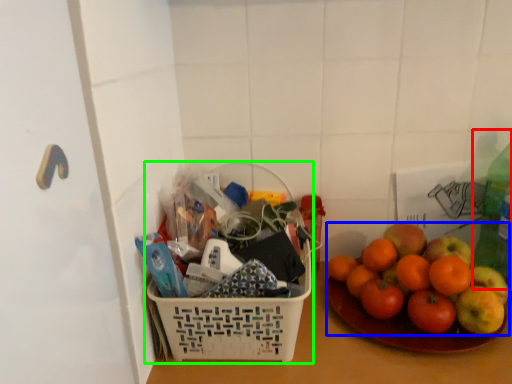
Question: Which is farther away from bottle (highlighted by a red box)? grapefruit (highlighted by a blue box) or basket (highlighted by a green box)?

Choices:
 (A) grapefruit
 (B) basket

Answer: (B)